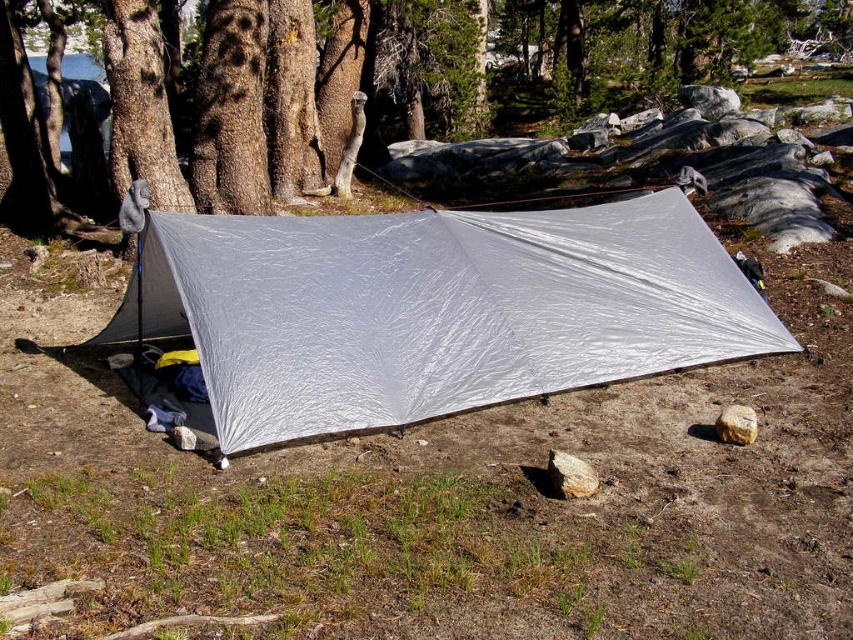
You are standing at the center of the silver tarp in the camping scene. You notice two points marked in the image. Which point, point (x=653, y=330) or point (x=223, y=154), is closer to you?

Point (x=653, y=330) is closer to the viewer than point (x=223, y=154).